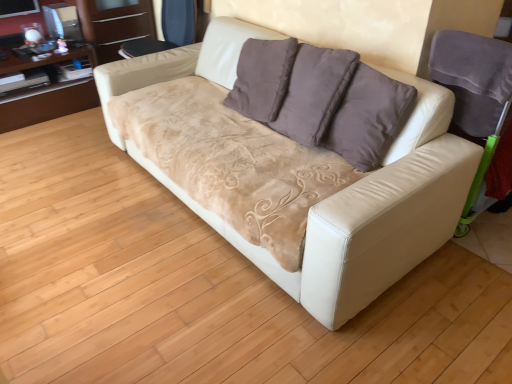
Question: Is matte brown wood dresser at upper left, which is counted as the 2th dresser, starting from the left, shorter than white leather couch at center?

Choices:
 (A) yes
 (B) no

Answer: (A)

Question: Is white leather couch at center completely or partially inside matte brown wood dresser at upper left, placed as the 1th dresser when sorted from right to left?

Choices:
 (A) no
 (B) yes

Answer: (A)

Question: Considering the relative positions of matte brown wood dresser at upper left, which is counted as the 2th dresser, starting from the left, and white leather couch at center in the image provided, is matte brown wood dresser at upper left, which is counted as the 2th dresser, starting from the left, to the right of white leather couch at center from the viewer's perspective?

Choices:
 (A) yes
 (B) no

Answer: (B)

Question: Is matte brown wood dresser at upper left, placed as the 1th dresser when sorted from right to left, positioned in front of white leather couch at center?

Choices:
 (A) yes
 (B) no

Answer: (B)

Question: From a real-world perspective, is matte brown wood dresser at upper left, placed as the 1th dresser when sorted from right to left, on white leather couch at center?

Choices:
 (A) no
 (B) yes

Answer: (B)

Question: Is matte brown wood dresser at upper left, placed as the 1th dresser when sorted from right to left, far from white leather couch at center?

Choices:
 (A) no
 (B) yes

Answer: (B)

Question: Does white leather armchair at right, placed as the first armchair when sorted from right to left, have a larger size compared to matte brown wood dresser at upper left, placed as the 1th dresser when sorted from right to left?

Choices:
 (A) no
 (B) yes

Answer: (A)

Question: Does white leather armchair at right, which appears as the 1th armchair when viewed from the front, turn towards matte brown wood dresser at upper left, which is counted as the 2th dresser, starting from the left?

Choices:
 (A) no
 (B) yes

Answer: (A)

Question: Considering the relative sizes of white leather armchair at right, placed as the first armchair when sorted from right to left, and matte brown wood dresser at upper left, which is counted as the 2th dresser, starting from the left, in the image provided, is white leather armchair at right, placed as the first armchair when sorted from right to left, shorter than matte brown wood dresser at upper left, which is counted as the 2th dresser, starting from the left,?

Choices:
 (A) yes
 (B) no

Answer: (A)

Question: Is white leather armchair at right, the second armchair positioned from the back, positioned before matte brown wood dresser at upper left, which is counted as the 2th dresser, starting from the left?

Choices:
 (A) no
 (B) yes

Answer: (B)

Question: Is white leather armchair at right, the second armchair when ordered from left to right, smaller than matte brown wood dresser at upper left, which is counted as the 2th dresser, starting from the left?

Choices:
 (A) yes
 (B) no

Answer: (A)

Question: Is white leather armchair at right, the second armchair when ordered from left to right, looking in the opposite direction of matte brown wood dresser at upper left, placed as the 1th dresser when sorted from right to left?

Choices:
 (A) no
 (B) yes

Answer: (A)

Question: From the image's perspective, is white leather armchair at right, which appears as the 1th armchair when ordered from the bottom, above brown wood dresser at upper left, which ranks as the first dresser in left-to-right order?

Choices:
 (A) yes
 (B) no

Answer: (B)